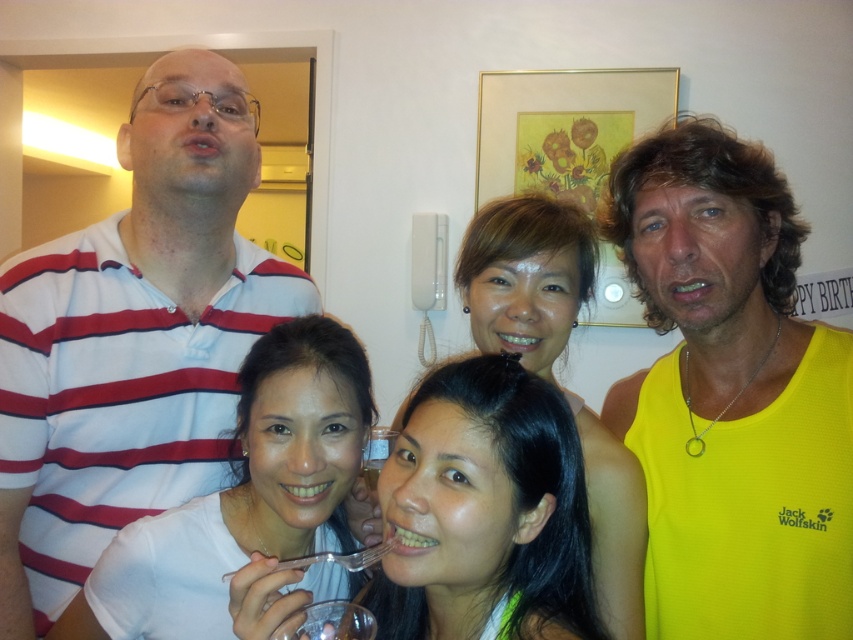
Can you confirm if white striped shirt at left is positioned below yellow fabric tank top at right?

Incorrect, white striped shirt at left is not positioned below yellow fabric tank top at right.

Is point (148, 486) less distant than point (618, 397)?

Yes, point (148, 486) is in front of point (618, 397).

Find the location of a particular element. This screenshot has width=853, height=640. white striped shirt at left is located at coordinates (132, 339).

Can you confirm if white striped shirt at left is shorter than white matte shirt at center?

In fact, white striped shirt at left may be taller than white matte shirt at center.

Does white striped shirt at left have a smaller size compared to white matte shirt at center?

No.

Which is behind, point (35, 326) or point (351, 368)?

The point (35, 326) is more distant.

This screenshot has height=640, width=853. What are the coordinates of `white striped shirt at left` in the screenshot? It's located at (132, 339).

Is point (177, 502) positioned before point (376, 460)?

Yes, it is in front of point (376, 460).

Can you confirm if white striped shirt at left is positioned below clear plastic cup at center?

Incorrect, white striped shirt at left is not positioned below clear plastic cup at center.

Locate an element on the screen. The height and width of the screenshot is (640, 853). white striped shirt at left is located at coordinates (132, 339).